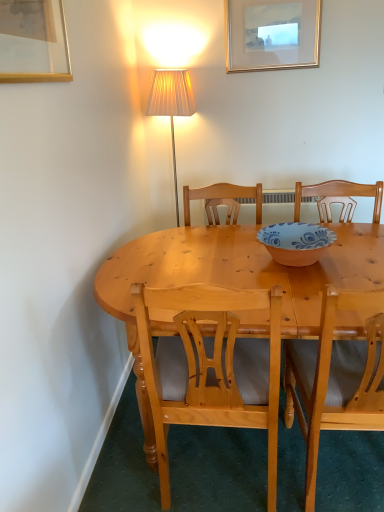
Describe the element at coordinates (211, 367) in the screenshot. This screenshot has height=512, width=384. I see `light wood chair at center, which is the 2th chair in right-to-left order` at that location.

This screenshot has width=384, height=512. What are the coordinates of `gold-framed picture at upper left, the 1th picture frame from the front` in the screenshot? It's located at (33, 42).

What do you see at coordinates (336, 377) in the screenshot?
I see `light wood chair at center, which is the first chair from right to left` at bounding box center [336, 377].

Identify the location of gold metallic picture frame at upper center, which appears as the second picture frame when ordered from the bottom. (272, 34).

Image resolution: width=384 pixels, height=512 pixels. Find the location of `light wood chair at center, acting as the first chair starting from the left`. light wood chair at center, acting as the first chair starting from the left is located at coordinates (211, 367).

Is the position of matte orange bowl at center more distant than that of light wood chair at center, positioned as the 2th chair in left-to-right order?

That is True.

Could light wood chair at center, positioned as the 2th chair in left-to-right order, be considered to be inside matte orange bowl at center?

No, light wood chair at center, positioned as the 2th chair in left-to-right order, is not surrounded by matte orange bowl at center.

In terms of size, does matte orange bowl at center appear bigger or smaller than light wood chair at center, which is the first chair from right to left?

matte orange bowl at center is smaller than light wood chair at center, which is the first chair from right to left.

Is matte orange bowl at center not near light wood chair at center, positioned as the 2th chair in left-to-right order?

No.

From the image's perspective, which object appears higher, gold-framed picture at upper left, acting as the 2th picture frame starting from the top, or matte orange bowl at center?

gold-framed picture at upper left, acting as the 2th picture frame starting from the top, appears higher in the image.

Between gold-framed picture at upper left, the 1th picture frame ordered from the bottom, and matte orange bowl at center, which one has more height?

Standing taller between the two is gold-framed picture at upper left, the 1th picture frame ordered from the bottom.

Is point (46, 68) closer or farther from the camera than point (292, 262)?

Point (46, 68).

Is matte orange bowl at center inside gold-framed picture at upper left, the 2th picture frame from the back?

No, matte orange bowl at center is not inside gold-framed picture at upper left, the 2th picture frame from the back.

Can you tell me how much matte orange bowl at center and gold metallic picture frame at upper center, marked as the first picture frame in a back-to-front arrangement, differ in facing direction?

There is a 90.7-degree angle between the facing directions of matte orange bowl at center and gold metallic picture frame at upper center, marked as the first picture frame in a back-to-front arrangement.

Considering the sizes of objects matte orange bowl at center and gold metallic picture frame at upper center, marked as the first picture frame in a back-to-front arrangement, in the image provided, who is wider, matte orange bowl at center or gold metallic picture frame at upper center, marked as the first picture frame in a back-to-front arrangement,?

With larger width is matte orange bowl at center.

In the scene shown: Is matte orange bowl at center located outside gold metallic picture frame at upper center, which appears as the second picture frame when ordered from the bottom?

Yes, matte orange bowl at center is not within gold metallic picture frame at upper center, which appears as the second picture frame when ordered from the bottom.

From a real-world perspective, which picture frame is the 2nd one above the matte orange bowl at center? Please provide its 2D coordinates.

[(272, 34)]

Looking at this image, how different are the orientations of gold-framed picture at upper left, which is the 1th picture frame from left to right, and gold metallic picture frame at upper center, marked as the second picture frame in a left-to-right arrangement, in degrees?

There is a 90.4-degree angle between the facing directions of gold-framed picture at upper left, which is the 1th picture frame from left to right, and gold metallic picture frame at upper center, marked as the second picture frame in a left-to-right arrangement.

Which object is more forward, gold-framed picture at upper left, the 1th picture frame from the front, or gold metallic picture frame at upper center, the first picture frame viewed from the top?

gold-framed picture at upper left, the 1th picture frame from the front, is in front.

Is point (44, 77) positioned after point (261, 61)?

No, it is not.

Is gold-framed picture at upper left, the 1th picture frame from the front, wider than gold metallic picture frame at upper center, the first picture frame viewed from the top?

Yes.

In the scene shown: Is light wood chair at center, acting as the first chair starting from the left, wider or thinner than light wood chair at center, positioned as the 2th chair in left-to-right order?

In the image, light wood chair at center, acting as the first chair starting from the left, appears to be more narrow than light wood chair at center, positioned as the 2th chair in left-to-right order.

Is light wood chair at center, acting as the first chair starting from the left, to the left of light wood chair at center, which is the first chair from right to left, from the viewer's perspective?

Yes, light wood chair at center, acting as the first chair starting from the left, is to the left of light wood chair at center, which is the first chair from right to left.

Does light wood chair at center, which is the 2th chair in right-to-left order, have a lesser height compared to light wood chair at center, which is the first chair from right to left?

Correct, light wood chair at center, which is the 2th chair in right-to-left order, is not as tall as light wood chair at center, which is the first chair from right to left.

How far apart are light wood chair at center, which is the 2th chair in right-to-left order, and light wood chair at center, which is the first chair from right to left?

They are 10.89 inches apart.

From a real-world perspective, is gold-framed picture at upper left, the 1th picture frame from the front, physically located above or below light wood chair at center, acting as the first chair starting from the left?

gold-framed picture at upper left, the 1th picture frame from the front, is above light wood chair at center, acting as the first chair starting from the left.

Choose the correct answer: Is gold-framed picture at upper left, the 1th picture frame ordered from the bottom, inside light wood chair at center, acting as the first chair starting from the left, or outside it?

gold-framed picture at upper left, the 1th picture frame ordered from the bottom, is not inside light wood chair at center, acting as the first chair starting from the left, it's outside.

Considering the points (36, 29) and (236, 358), which point is in front, point (36, 29) or point (236, 358)?

The point (36, 29) is closer.

Which of these two, gold-framed picture at upper left, which is the 1th picture frame from left to right, or light wood chair at center, which is the 2th chair in right-to-left order, stands shorter?

gold-framed picture at upper left, which is the 1th picture frame from left to right.

The image size is (384, 512). I want to click on bowl on the right side of gold-framed picture at upper left, acting as the 2th picture frame starting from the right, so click(296, 242).

Can you confirm if matte orange bowl at center is shorter than gold-framed picture at upper left, the 1th picture frame ordered from the bottom?

Correct, matte orange bowl at center is not as tall as gold-framed picture at upper left, the 1th picture frame ordered from the bottom.

Considering the points (293, 234) and (14, 67), which point is in front, point (293, 234) or point (14, 67)?

Positioned in front is point (14, 67).

Is matte orange bowl at center positioned behind gold-framed picture at upper left, acting as the 2th picture frame starting from the top?

Yes, matte orange bowl at center is behind gold-framed picture at upper left, acting as the 2th picture frame starting from the top.

The image size is (384, 512). Find the location of `bowl lying above the light wood chair at center, positioned as the 2th chair in left-to-right order (from the image's perspective)`. bowl lying above the light wood chair at center, positioned as the 2th chair in left-to-right order (from the image's perspective) is located at coordinates (296, 242).

The width and height of the screenshot is (384, 512). What are the coordinates of `bowl below the gold-framed picture at upper left, the 1th picture frame ordered from the bottom (from a real-world perspective)` in the screenshot? It's located at (296, 242).

Based on their spatial positions, is light wood chair at center, which is the 2th chair in right-to-left order, or gold metallic picture frame at upper center, the first picture frame viewed from the top, further from gold-framed picture at upper left, the 2th picture frame from the back?

gold metallic picture frame at upper center, the first picture frame viewed from the top, is positioned further to the anchor gold-framed picture at upper left, the 2th picture frame from the back.

Looking at the image, which one is located closer to matte orange bowl at center, light wood chair at center, which is the first chair from right to left, or light wood chair at center, which is the 2th chair in right-to-left order?

light wood chair at center, which is the first chair from right to left, is positioned closer to the anchor matte orange bowl at center.

Looking at the image, which one is located further to light wood chair at center, which is the first chair from right to left, gold-framed picture at upper left, the 1th picture frame ordered from the bottom, or gold metallic picture frame at upper center, marked as the second picture frame in a left-to-right arrangement?

The object further to light wood chair at center, which is the first chair from right to left, is gold metallic picture frame at upper center, marked as the second picture frame in a left-to-right arrangement.

From the image, which object appears to be nearer to gold-framed picture at upper left, the 2th picture frame from the back, matte orange bowl at center or light wood chair at center, which is the first chair from right to left?

Based on the image, matte orange bowl at center appears to be nearer to gold-framed picture at upper left, the 2th picture frame from the back.

From the picture: Based on their spatial positions, is light wood chair at center, which is the 2th chair in right-to-left order, or light wood chair at center, positioned as the 2th chair in left-to-right order, closer to matte orange bowl at center?

Based on the image, light wood chair at center, positioned as the 2th chair in left-to-right order, appears to be nearer to matte orange bowl at center.

Based on their spatial positions, is light wood chair at center, which is the 2th chair in right-to-left order, or matte orange bowl at center closer to gold-framed picture at upper left, the 2th picture frame from the back?

light wood chair at center, which is the 2th chair in right-to-left order, is closer to gold-framed picture at upper left, the 2th picture frame from the back.

Considering their positions, is gold-framed picture at upper left, the 1th picture frame from the front, positioned closer to light wood chair at center, which is the first chair from right to left, than matte orange bowl at center?

Among the two, matte orange bowl at center is located nearer to light wood chair at center, which is the first chair from right to left.

Looking at the image, which one is located further to gold metallic picture frame at upper center, the first picture frame viewed from the top, gold-framed picture at upper left, acting as the 2th picture frame starting from the top, or matte orange bowl at center?

gold-framed picture at upper left, acting as the 2th picture frame starting from the top, is further to gold metallic picture frame at upper center, the first picture frame viewed from the top.

At what (x,y) coordinates should I click in order to perform the action: click on picture frame between gold metallic picture frame at upper center, the 1th picture frame from the right, and light wood chair at center, which is the first chair from right to left, vertically. Please return your answer as a coordinate pair (x, y). The height and width of the screenshot is (512, 384). Looking at the image, I should click on (33, 42).

Where is `bowl located between gold-framed picture at upper left, acting as the 2th picture frame starting from the top, and light wood chair at center, which is the first chair from right to left, in the left-right direction`? This screenshot has width=384, height=512. bowl located between gold-framed picture at upper left, acting as the 2th picture frame starting from the top, and light wood chair at center, which is the first chair from right to left, in the left-right direction is located at coordinates (296, 242).

Where is `chair that lies between gold metallic picture frame at upper center, the 1th picture frame from the right, and light wood chair at center, acting as the first chair starting from the left, from top to bottom`? chair that lies between gold metallic picture frame at upper center, the 1th picture frame from the right, and light wood chair at center, acting as the first chair starting from the left, from top to bottom is located at coordinates (336, 377).

This screenshot has height=512, width=384. Find the location of `bowl that lies between gold metallic picture frame at upper center, marked as the first picture frame in a back-to-front arrangement, and light wood chair at center, which is the 2th chair in right-to-left order, from top to bottom`. bowl that lies between gold metallic picture frame at upper center, marked as the first picture frame in a back-to-front arrangement, and light wood chair at center, which is the 2th chair in right-to-left order, from top to bottom is located at coordinates (296, 242).